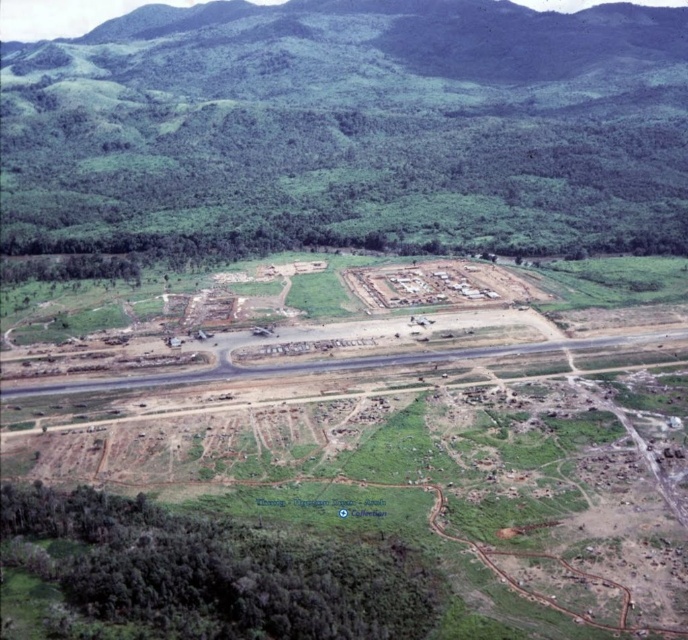
Is green leafy forest at upper center above asphalt road at center?

Correct, green leafy forest at upper center is located above asphalt road at center.

Is point (603, 147) farther from viewer compared to point (206, 376)?

That is True.

The height and width of the screenshot is (640, 688). What are the coordinates of `green leafy forest at upper center` in the screenshot? It's located at (350, 129).